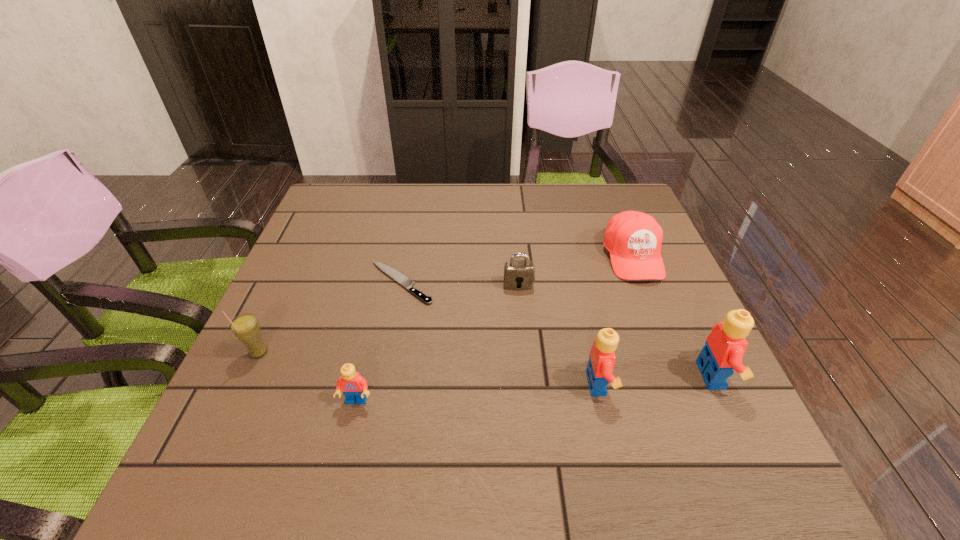
The width and height of the screenshot is (960, 540). Identify the location of vacant position for inserting another Lego evenly. (479, 392).